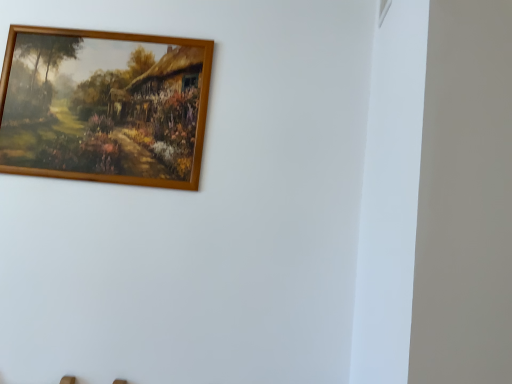
Question: Is wooden frame at upper left with white plastic window at upper right?

Choices:
 (A) yes
 (B) no

Answer: (B)

Question: From a real-world perspective, does wooden frame at upper left sit lower than white plastic window at upper right?

Choices:
 (A) yes
 (B) no

Answer: (A)

Question: Does wooden frame at upper left have a larger size compared to white plastic window at upper right?

Choices:
 (A) no
 (B) yes

Answer: (B)

Question: From the image's perspective, is wooden frame at upper left over white plastic window at upper right?

Choices:
 (A) yes
 (B) no

Answer: (B)

Question: Can we say wooden frame at upper left lies outside white plastic window at upper right?

Choices:
 (A) yes
 (B) no

Answer: (A)

Question: Considering the relative sizes of wooden frame at upper left and white plastic window at upper right in the image provided, is wooden frame at upper left taller than white plastic window at upper right?

Choices:
 (A) yes
 (B) no

Answer: (A)

Question: From a real-world perspective, does white plastic window at upper right stand above wooden frame at upper left?

Choices:
 (A) yes
 (B) no

Answer: (A)

Question: From the image's perspective, is white plastic window at upper right beneath wooden frame at upper left?

Choices:
 (A) no
 (B) yes

Answer: (A)

Question: Considering the relative sizes of white plastic window at upper right and wooden frame at upper left in the image provided, is white plastic window at upper right bigger than wooden frame at upper left?

Choices:
 (A) yes
 (B) no

Answer: (B)

Question: Is white plastic window at upper right shorter than wooden frame at upper left?

Choices:
 (A) yes
 (B) no

Answer: (A)

Question: Is white plastic window at upper right wider than wooden frame at upper left?

Choices:
 (A) yes
 (B) no

Answer: (B)

Question: Is white plastic window at upper right smaller than wooden frame at upper left?

Choices:
 (A) yes
 (B) no

Answer: (A)

Question: Is white plastic window at upper right to the left or to the right of wooden frame at upper left in the image?

Choices:
 (A) right
 (B) left

Answer: (A)